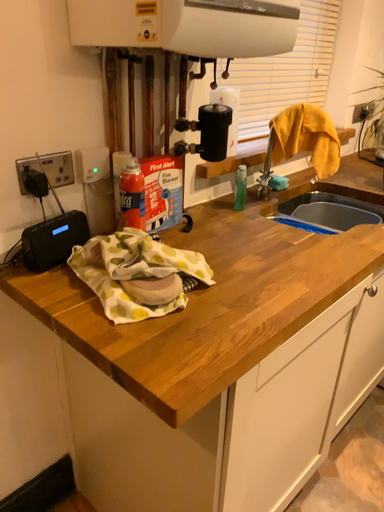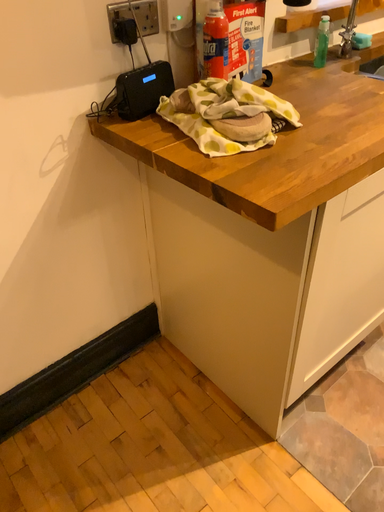
Question: How did the camera likely rotate when shooting the video?

Choices:
 (A) rotated downward
 (B) rotated upward

Answer: (A)